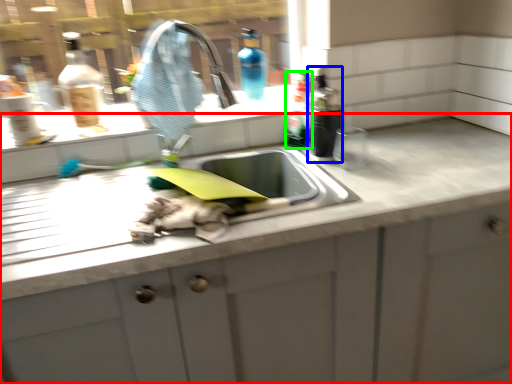
Question: Based on their relative distances, which object is nearer to countertop (highlighted by a red box)? Choose from bottle (highlighted by a blue box) and bottle (highlighted by a green box).

Choices:
 (A) bottle
 (B) bottle

Answer: (A)